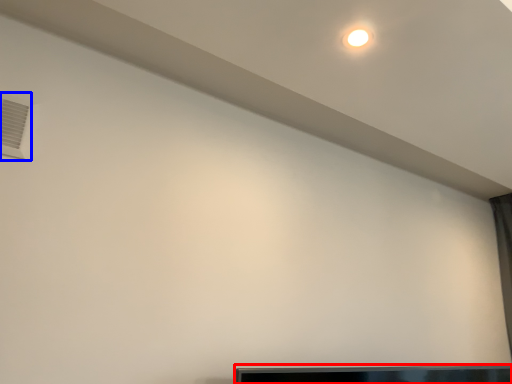
Question: Which object appears closest to the camera in this image, furniture (highlighted by a red box) or air conditioning (highlighted by a blue box)?

Choices:
 (A) furniture
 (B) air conditioning

Answer: (B)